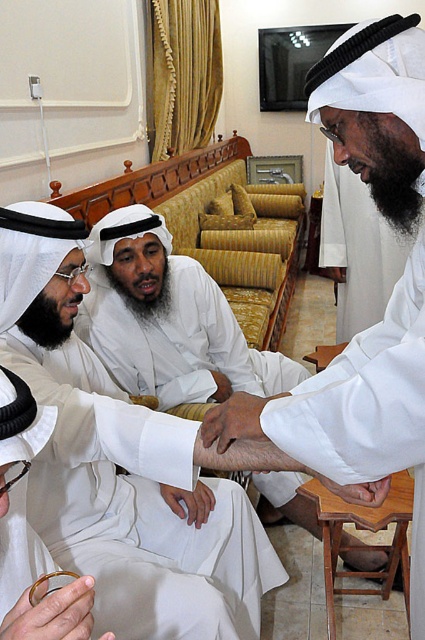
Is white matte robe at center above wooden stool at lower right?

Yes, white matte robe at center is above wooden stool at lower right.

In the scene shown: Does white matte robe at center have a lesser width compared to wooden stool at lower right?

Indeed, white matte robe at center has a lesser width compared to wooden stool at lower right.

You are a GUI agent. You are given a task and a screenshot of the screen. Output one action in this format:
    pyautogui.click(x=<x>, y=<y>)
    Task: Click on the white matte robe at center
    
    Given the screenshot: What is the action you would take?
    coord(370,410)

Locate an element on the screen. white matte robe at center is located at coordinates (370, 410).

Looking at this image, measure the distance between white satin robe at center and camera.

white satin robe at center and camera are 1.11 meters apart from each other.

Identify the location of white satin robe at center. Image resolution: width=425 pixels, height=640 pixels. (138, 508).

Looking at this image, is matte white hand at center positioned at the back of smooth skin hand at lower right?

No, it is in front of smooth skin hand at lower right.

Who is more forward, (234, 400) or (362, 502)?

Point (362, 502) is in front.

Does point (246, 416) come behind point (342, 492)?

No, (246, 416) is closer to viewer.

Where is `matte white hand at center`? matte white hand at center is located at coordinates (232, 420).